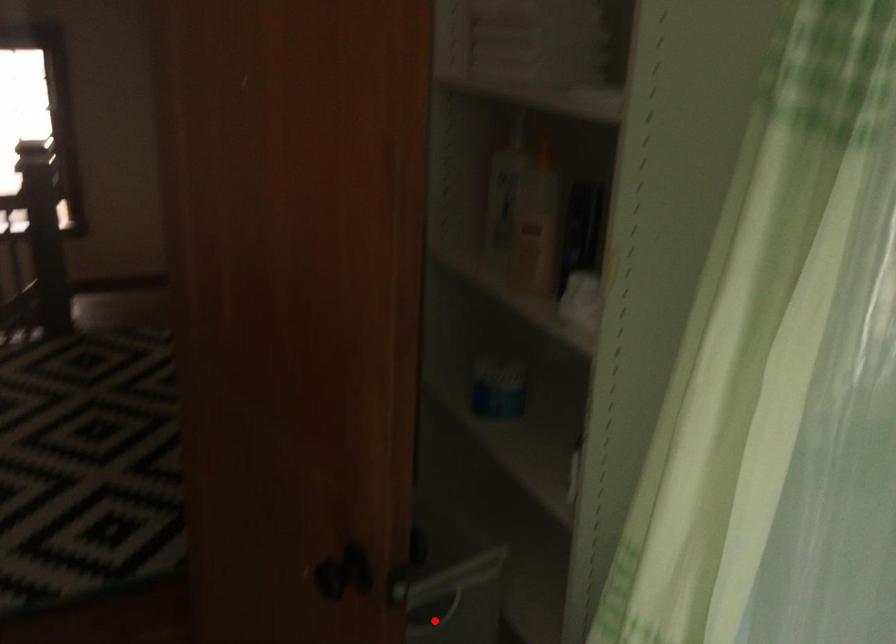
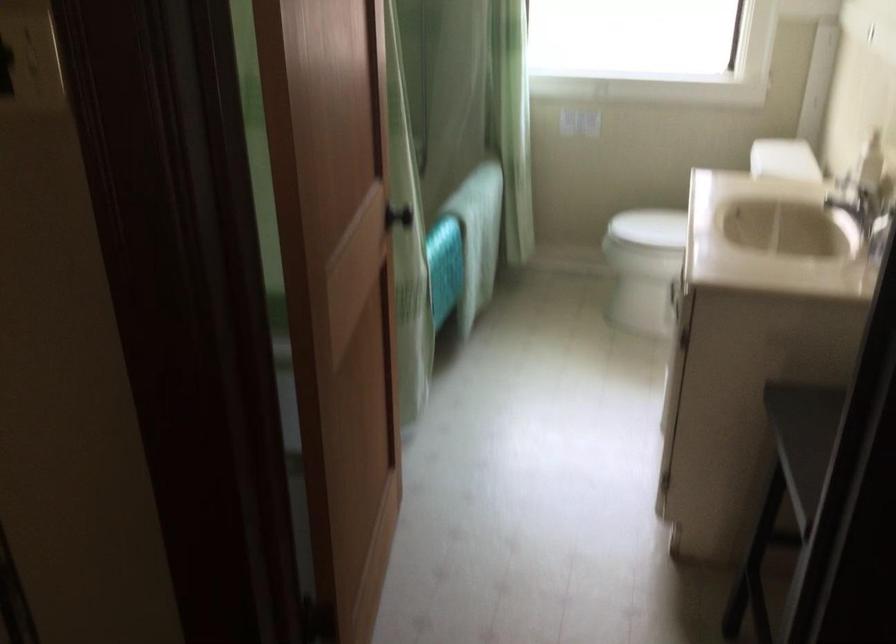
Question: I am providing you with two images of the same scene from different viewpoints. A red point is marked on the first image. At the location where the point appears in image 1, is it still visible in image 2?

Choices:
 (A) Yes
 (B) No

Answer: (B)